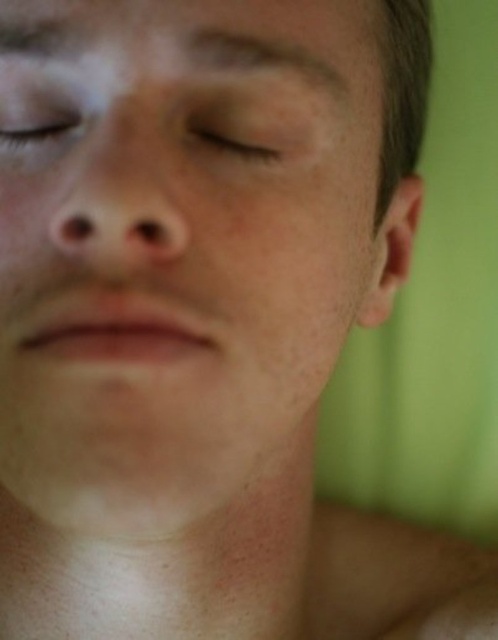
Does point (199, 65) lie behind point (75, 104)?

That is False.

Which is behind, point (29, 333) or point (2, 150)?

Point (2, 150)

The image size is (498, 640). In order to click on smooth skin face at center in this screenshot , I will do `click(178, 248)`.

Who is more distant from viewer, (173,42) or (255,97)?

The point (255,97) is behind.

In the scene shown: Which is below, smooth skin face at center or matte skin at center?

smooth skin face at center

This screenshot has height=640, width=498. Find the location of `smooth skin face at center`. smooth skin face at center is located at coordinates (178, 248).

Image resolution: width=498 pixels, height=640 pixels. Identify the location of smooth skin face at center. (178, 248).

Does point (266, 147) come closer to viewer compared to point (48, 100)?

No, it is behind (48, 100).

Between matte skin at center and matte skin eye at upper center, which one is positioned lower?

matte skin at center is below.

Describe the element at coordinates (249, 128) in the screenshot. The height and width of the screenshot is (640, 498). I see `matte skin at center` at that location.

Locate an element on the screen. Image resolution: width=498 pixels, height=640 pixels. matte skin at center is located at coordinates (249, 128).